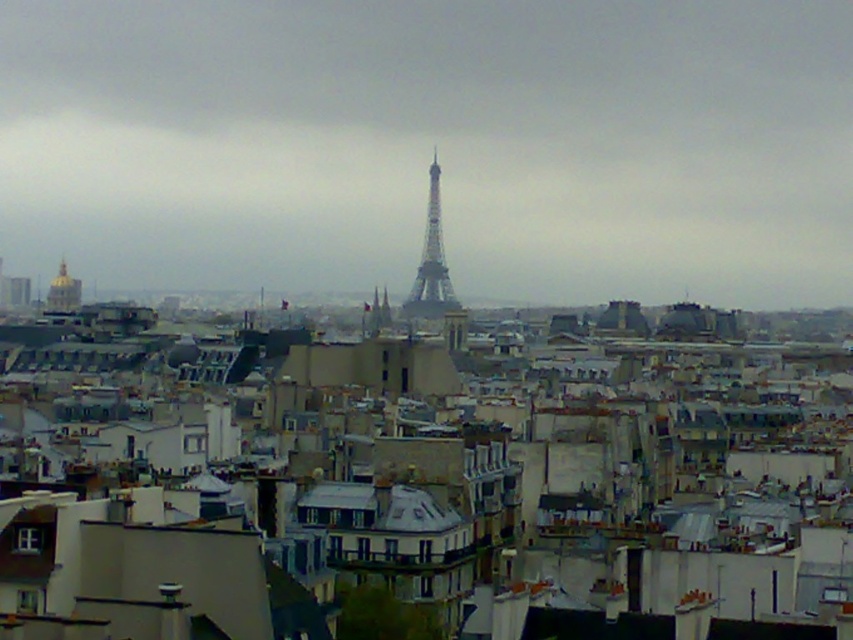
You are a drone operator planning to fly a drone from the gold dome at upper left to the metallic gray eiffel tower at center. Given that your drone has a maximum flight range of 120 meters, will it be able to reach the tower without needing a recharge?

The distance between the metallic gray eiffel tower at center and the gold dome at upper left is 128.51 meters. Since the drone can only fly up to 120 meters before needing a recharge, it will not be able to reach the tower without recharging.